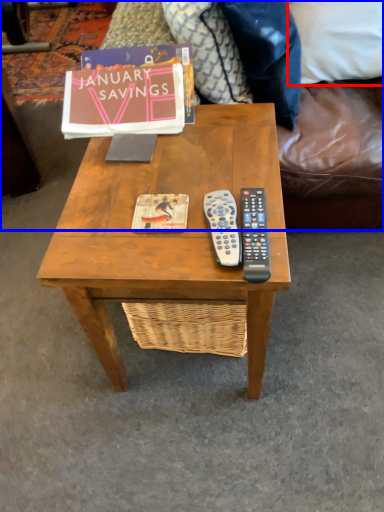
Question: Among these objects, which one is farthest to the camera, pillow (highlighted by a red box) or studio couch (highlighted by a blue box)?

Choices:
 (A) pillow
 (B) studio couch

Answer: (A)